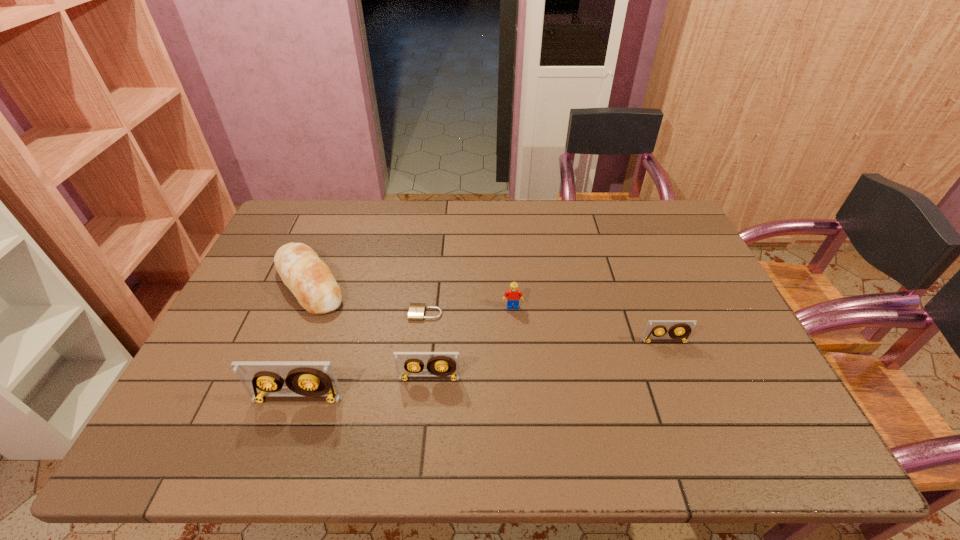
Locate an element on the screen. The image size is (960, 540). vacant space in between the leftmost videotape and the bread is located at coordinates (303, 342).

The width and height of the screenshot is (960, 540). What are the coordinates of `free space that is in between the second videotape from left to right and the second object from right to left` in the screenshot? It's located at (471, 342).

What are the coordinates of `vacant space that's between the Lego and the third nearest object` in the screenshot? It's located at (588, 324).

Locate an element on the screen. The image size is (960, 540). free space between the second nearest videotape and the fifth object from left to right is located at coordinates point(471,342).

Where is `empty location between the bread and the shortest videotape`? This screenshot has height=540, width=960. empty location between the bread and the shortest videotape is located at coordinates (487, 313).

This screenshot has width=960, height=540. What are the coordinates of `vacant area between the second tallest videotape and the second shortest object` in the screenshot? It's located at (547, 360).

This screenshot has width=960, height=540. In order to click on vacant area between the nearest object and the padlock in this screenshot , I will do `click(361, 356)`.

Where is `empty space that is in between the second farthest videotape and the padlock`? This screenshot has width=960, height=540. empty space that is in between the second farthest videotape and the padlock is located at coordinates (427, 346).

The width and height of the screenshot is (960, 540). I want to click on vacant space that is in between the fifth farthest object and the rightmost object, so point(547,360).

This screenshot has height=540, width=960. What are the coordinates of `object that is the fourth closest to the bread` in the screenshot? It's located at pos(513,295).